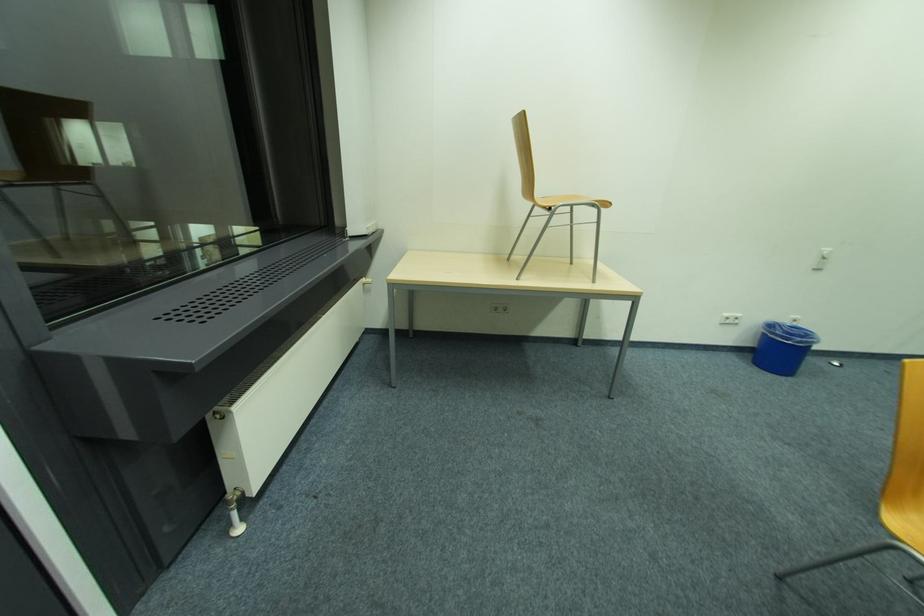
What do you see at coordinates (562, 199) in the screenshot? This screenshot has height=616, width=924. I see `a chair sitting surface` at bounding box center [562, 199].